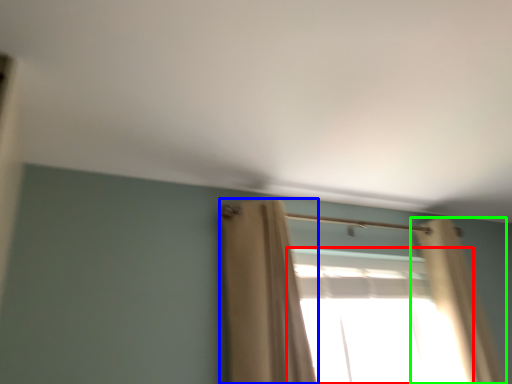
Question: Which object is the farthest from window (highlighted by a red box)? Choose among these: curtain (highlighted by a blue box) or curtain (highlighted by a green box).

Choices:
 (A) curtain
 (B) curtain

Answer: (A)